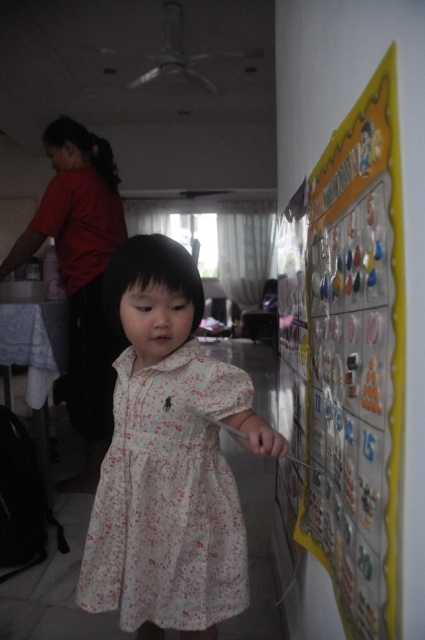
Question: Among these objects, which one is farthest from the camera?

Choices:
 (A) white floral dress at center
 (B) yellow paperboard at right

Answer: (A)

Question: Is yellow paperboard at right below white floral dress at center?

Choices:
 (A) no
 (B) yes

Answer: (A)

Question: Can you confirm if yellow paperboard at right is positioned above white floral dress at center?

Choices:
 (A) yes
 (B) no

Answer: (A)

Question: Can you confirm if yellow paperboard at right is wider than white floral dress at center?

Choices:
 (A) yes
 (B) no

Answer: (B)

Question: Which point is closer to the camera?

Choices:
 (A) yellow paperboard at right
 (B) white floral dress at center

Answer: (A)